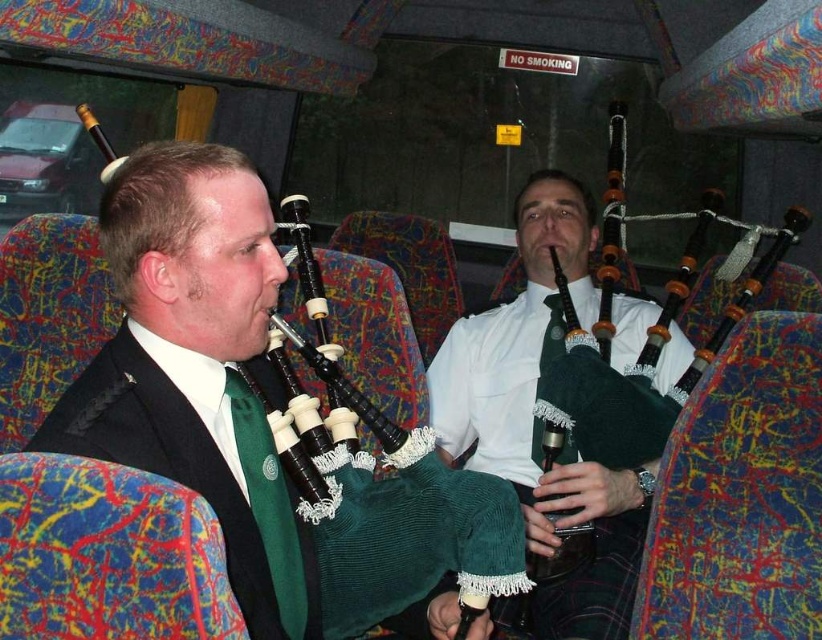
You are a tailor who needs to adjust the green corduroy kilt at center and the green corduroy tie at center. Which item requires more fabric to make?

The green corduroy kilt at center requires more fabric because it has a larger size compared to the green corduroy tie at center.

You are a passenger on the bus and want to place your small backpack between the matte black bagpipes at center and the green corduroy tie at center. Considering their heights, which object should you place the backpack closer to?

The matte black bagpipes at center is much taller than the green corduroy tie at center, so you should place the backpack closer to the green corduroy tie at center to ensure stability.

You are a photographer trying to capture a closeup of the green corduroy tie at center and the green corduroy kilt at center. Which one is closer to the camera?

The green corduroy kilt at center is closer to the camera because the green corduroy tie at center is behind it.